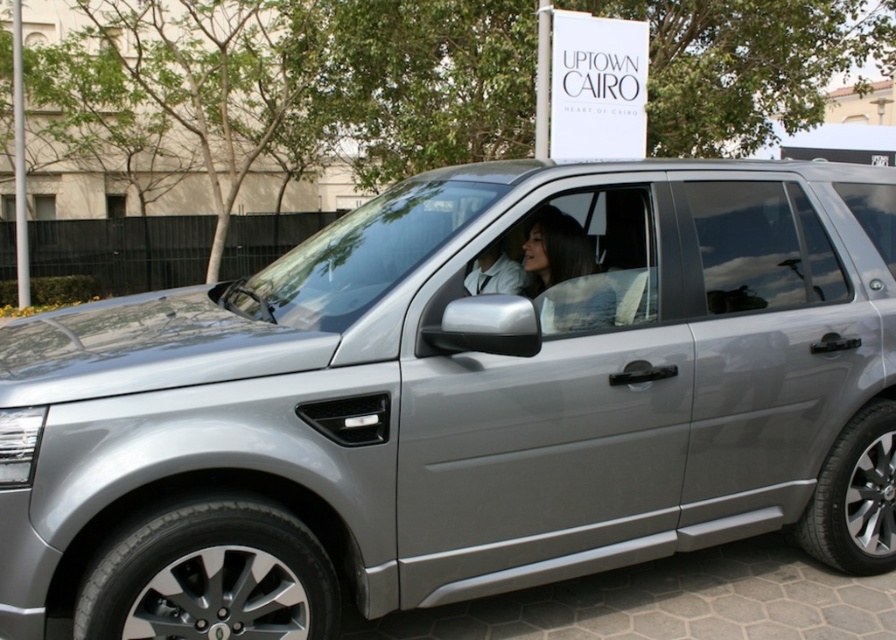
Which is below, light gray fabric shirt at center or transparent glass window at upper left?

light gray fabric shirt at center

The height and width of the screenshot is (640, 896). Describe the element at coordinates (494, 273) in the screenshot. I see `light gray fabric shirt at center` at that location.

Locate an element on the screen. This screenshot has height=640, width=896. light gray fabric shirt at center is located at coordinates (494, 273).

Who is more forward, (613,321) or (108,209)?

Point (613,321) is in front.

Who is taller, smooth black hair at center or transparent glass window at upper left?

With more height is transparent glass window at upper left.

Does point (532, 244) come farther from viewer compared to point (123, 204)?

That is False.

I want to click on smooth black hair at center, so click(565, 275).

Who is higher up, transparent glass window at center or light gray fabric shirt at center?

Positioned higher is transparent glass window at center.

Measure the distance from transparent glass window at center to light gray fabric shirt at center.

transparent glass window at center is 1.04 meters from light gray fabric shirt at center.

The image size is (896, 640). What do you see at coordinates (762, 248) in the screenshot?
I see `transparent glass window at center` at bounding box center [762, 248].

At what (x,y) coordinates should I click in order to perform the action: click on transparent glass window at center. Please return your answer as a coordinate pair (x, y). This screenshot has height=640, width=896. Looking at the image, I should click on (762, 248).